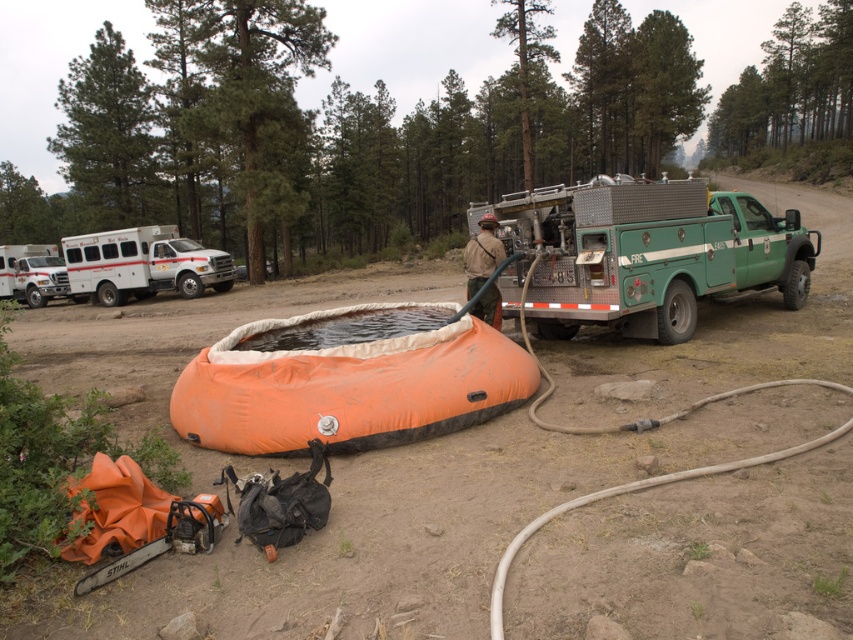
Does green textured trees at upper center appear on the left side of black rubber tire at right?

No, green textured trees at upper center is not to the left of black rubber tire at right.

Between point (206, 72) and point (677, 291), which one is positioned in front?

Point (677, 291) is in front.

Who is more distant from viewer, [100,164] or [676,301]?

The point [100,164] is behind.

In order to click on green textured trees at upper center in this screenshot , I will do `click(343, 132)`.

Does point (798, 449) come in front of point (490, 248)?

Yes, point (798, 449) is closer to viewer.

Between rubber/soft hose at right and brown canvas backpack at center, which one has less height?

With less height is rubber/soft hose at right.

Find the location of a particular element. This screenshot has height=640, width=853. rubber/soft hose at right is located at coordinates (625, 492).

Locate an element on the screen. rubber/soft hose at right is located at coordinates (625, 492).

Is point (567, 276) positioned before point (498, 301)?

Yes, point (567, 276) is in front of point (498, 301).

Between green metallic utility truck at center-right and brown canvas backpack at center, which one is positioned lower?

Positioned lower is brown canvas backpack at center.

Between point (785, 305) and point (474, 248), which one is positioned in front?

Point (474, 248) is in front.

I want to click on green metallic utility truck at center-right, so click(643, 250).